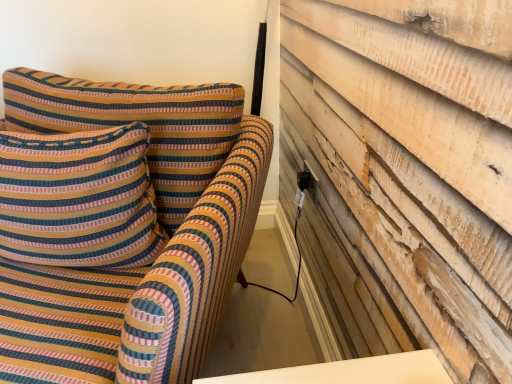
Question: Does striped fabric pillow at upper left have a lesser height compared to striped fabric sofa at left?

Choices:
 (A) yes
 (B) no

Answer: (A)

Question: Is striped fabric pillow at upper left surrounding striped fabric sofa at left?

Choices:
 (A) yes
 (B) no

Answer: (B)

Question: From a real-world perspective, is striped fabric pillow at upper left located beneath striped fabric sofa at left?

Choices:
 (A) yes
 (B) no

Answer: (B)

Question: Could you tell me if striped fabric pillow at upper left is facing striped fabric sofa at left?

Choices:
 (A) yes
 (B) no

Answer: (A)

Question: Is striped fabric pillow at upper left positioned with its back to striped fabric sofa at left?

Choices:
 (A) no
 (B) yes

Answer: (B)

Question: Is striped fabric pillow at upper left outside striped fabric sofa at left?

Choices:
 (A) no
 (B) yes

Answer: (A)

Question: Does striped fabric pillow at upper left touch black plastic electric outlet at upper right?

Choices:
 (A) yes
 (B) no

Answer: (B)

Question: From a real-world perspective, is striped fabric pillow at upper left on black plastic electric outlet at upper right?

Choices:
 (A) no
 (B) yes

Answer: (B)

Question: Is black plastic electric outlet at upper right at the back of striped fabric pillow at upper left?

Choices:
 (A) yes
 (B) no

Answer: (B)

Question: Can you confirm if striped fabric pillow at upper left is smaller than black plastic electric outlet at upper right?

Choices:
 (A) no
 (B) yes

Answer: (A)

Question: Is striped fabric pillow at upper left to the right of black plastic electric outlet at upper right from the viewer's perspective?

Choices:
 (A) yes
 (B) no

Answer: (B)

Question: Does striped fabric pillow at upper left have a lesser width compared to black plastic electric outlet at upper right?

Choices:
 (A) no
 (B) yes

Answer: (A)

Question: From the image's perspective, is black plastic electric outlet at upper right located above striped fabric pillow at upper left?

Choices:
 (A) yes
 (B) no

Answer: (A)